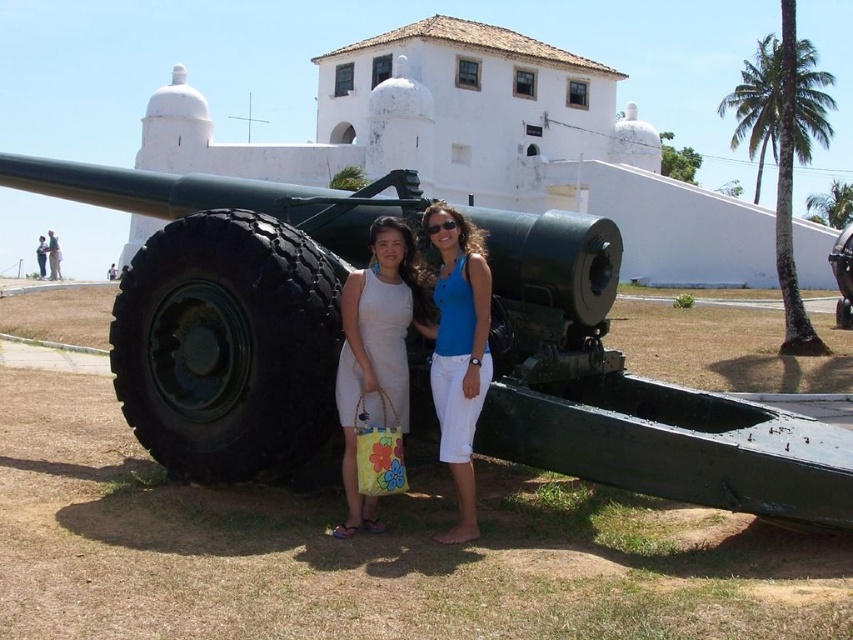
You are standing in a historical outdoor area and see the green leafy palm tree at right and the blue cotton tank top at center. Which object is located to the right of the other?

The green leafy palm tree at right is positioned on the right side of blue cotton tank top at center.

You are a tour guide leading a group near the green matte cannon at center and the green leafy palm tree at right. Your group wants to know if they can comfortably walk between the two without any obstacles. Given that the average walking path width required for a group of 10 people is 2 meters, can they walk between them comfortably?

The distance between the green matte cannon at center and the green leafy palm tree at right is 33.70 meters. Since the required width for the group is only 2 meters, there is more than enough space for them to walk comfortably between the two objects without any issues.

You are a photographer trying to capture a photo of the white fabric dress at center and the green leafy palm tree at right. Based on their positions, which object is closer to the ground?

The white fabric dress at center is located below the green leafy palm tree at right, meaning it is closer to the ground.